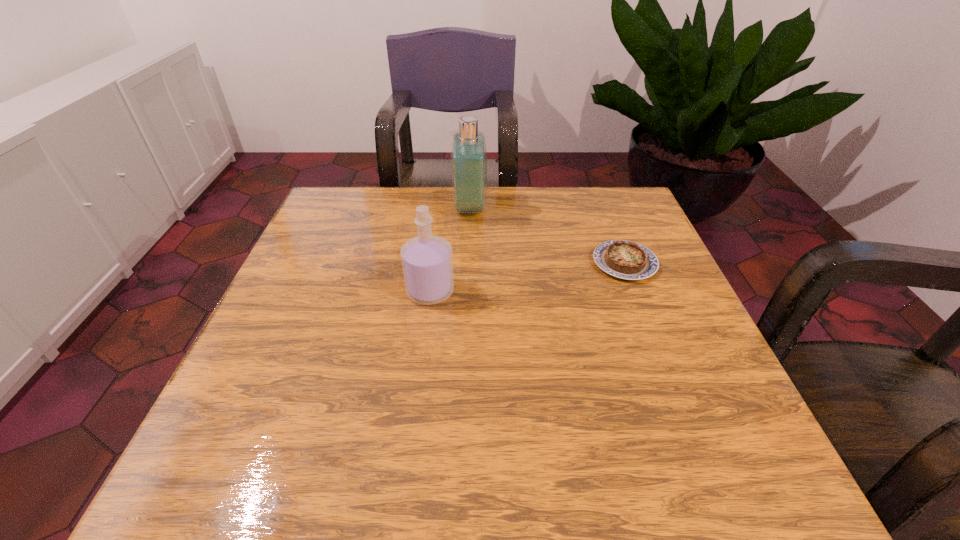
At what (x,y) coordinates should I click in order to perform the action: click on the farther perfume. Please return your answer as a coordinate pair (x, y). Looking at the image, I should click on (468, 153).

In order to click on the nearer perfume in this screenshot , I will do `click(427, 261)`.

Locate an element on the screen. This screenshot has width=960, height=540. the second tallest object is located at coordinates (427, 261).

In order to click on quiche in this screenshot , I will do `click(623, 259)`.

Where is `the rightmost object`? Image resolution: width=960 pixels, height=540 pixels. the rightmost object is located at coordinates (623, 259).

This screenshot has width=960, height=540. In order to click on blank space located on the front label of the farther perfume in this screenshot , I will do `click(547, 208)`.

Identify the location of free space located 0.250m on the left of the second tallest object. The width and height of the screenshot is (960, 540). (286, 291).

I want to click on free space located on the front of the rightmost object, so 651,329.

The image size is (960, 540). I want to click on object that is positioned at the far edge, so click(468, 153).

Locate an element on the screen. This screenshot has width=960, height=540. object located in the right edge section of the desktop is located at coordinates (623, 259).